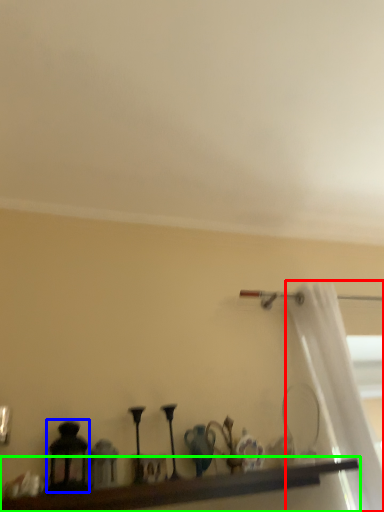
Question: Based on their relative distances, which object is farther from curtain (highlighted by a red box)? Choose from candle holder (highlighted by a blue box) and shelf (highlighted by a green box).

Choices:
 (A) candle holder
 (B) shelf

Answer: (A)